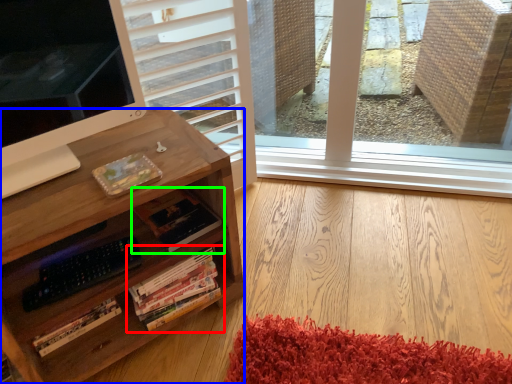
Question: Considering the real-world distances, which object is closest to book (highlighted by a red box)? desk (highlighted by a blue box) or book (highlighted by a green box).

Choices:
 (A) desk
 (B) book

Answer: (B)